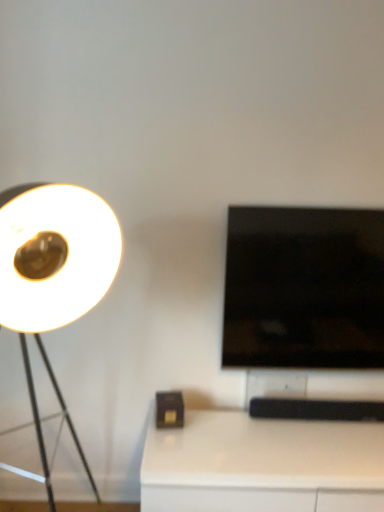
Where is `white glossy table at lower right`? white glossy table at lower right is located at coordinates (262, 465).

From the image's perspective, does black glossy tv at right appear higher than white matte lamp at left?

Yes, from the image's perspective, black glossy tv at right is over white matte lamp at left.

From a real-world perspective, which object rests below the other?

white matte lamp at left.

I want to click on television on the right of white matte lamp at left, so click(x=304, y=288).

Is black glossy tv at right positioned beyond the bounds of white matte lamp at left?

black glossy tv at right is positioned outside white matte lamp at left.

Which of these two, white matte lamp at left or black glossy tv at right, is smaller?

Smaller between the two is black glossy tv at right.

The width and height of the screenshot is (384, 512). Find the location of `lamp to the left of black glossy tv at right`. lamp to the left of black glossy tv at right is located at coordinates (54, 272).

Relative to black glossy tv at right, is white matte lamp at left in front or behind?

white matte lamp at left is positioned closer to the viewer than black glossy tv at right.

Does black glossy tv at right have a lesser height compared to white glossy table at lower right?

In fact, black glossy tv at right may be taller than white glossy table at lower right.

Consider the image. Can you confirm if black glossy tv at right is thinner than white glossy table at lower right?

Yes, black glossy tv at right is thinner than white glossy table at lower right.

Can you confirm if black glossy tv at right is positioned to the right of white glossy table at lower right?

Correct, you'll find black glossy tv at right to the right of white glossy table at lower right.

Considering the relative sizes of white matte lamp at left and white glossy table at lower right in the image provided, is white matte lamp at left wider than white glossy table at lower right?

Indeed, white matte lamp at left has a greater width compared to white glossy table at lower right.

Would you say white matte lamp at left is outside white glossy table at lower right?

Indeed, white matte lamp at left is completely outside white glossy table at lower right.

In terms of height, does white matte lamp at left look taller or shorter compared to white glossy table at lower right?

white matte lamp at left is taller than white glossy table at lower right.

Is white glossy table at lower right at the back of white matte lamp at left?

No, white matte lamp at left is not facing away from white glossy table at lower right.

From the image's perspective, is white glossy table at lower right located beneath black glossy tv at right?

Yes.

Is white glossy table at lower right facing towards black glossy tv at right?

No, white glossy table at lower right is not facing towards black glossy tv at right.

Is white glossy table at lower right at the right side of black glossy tv at right?

No, white glossy table at lower right is not to the right of black glossy tv at right.

Is black glossy tv at right a part of white glossy table at lower right?

No, black glossy tv at right is not inside white glossy table at lower right.

Measure the distance from white glossy table at lower right to white matte lamp at left.

The distance of white glossy table at lower right from white matte lamp at left is 35.81 inches.

Is white glossy table at lower right positioned beyond the bounds of white matte lamp at left?

Indeed, white glossy table at lower right is completely outside white matte lamp at left.

Does white glossy table at lower right have a smaller size compared to white matte lamp at left?

Yes, white glossy table at lower right is smaller than white matte lamp at left.

In the image, is white glossy table at lower right on the left side or the right side of white matte lamp at left?

white glossy table at lower right is positioned on white matte lamp at left's right side.

In order to click on lamp on the left of black glossy tv at right in this screenshot , I will do `click(54, 272)`.

In order to click on lamp in front of the black glossy tv at right in this screenshot , I will do `click(54, 272)`.

Based on their spatial positions, is white matte lamp at left or black glossy tv at right further from white glossy table at lower right?

Among the two, white matte lamp at left is located further to white glossy table at lower right.

Estimate the real-world distances between objects in this image. Which object is closer to white matte lamp at left, white glossy table at lower right or black glossy tv at right?

black glossy tv at right lies closer to white matte lamp at left than the other object.

Which object lies nearer to the anchor point white matte lamp at left, black glossy tv at right or white glossy table at lower right?

→ black glossy tv at right is closer to white matte lamp at left.

Which object lies further to the anchor point black glossy tv at right, white matte lamp at left or white glossy table at lower right?

Based on the image, white matte lamp at left appears to be further to black glossy tv at right.

Considering their positions, is black glossy tv at right positioned further to white glossy table at lower right than white matte lamp at left?

white matte lamp at left.

Considering their positions, is white glossy table at lower right positioned closer to black glossy tv at right than white matte lamp at left?

white glossy table at lower right lies closer to black glossy tv at right than the other object.

Where is `table between white matte lamp at left and black glossy tv at right in the horizontal direction`? The width and height of the screenshot is (384, 512). table between white matte lamp at left and black glossy tv at right in the horizontal direction is located at coordinates (262, 465).